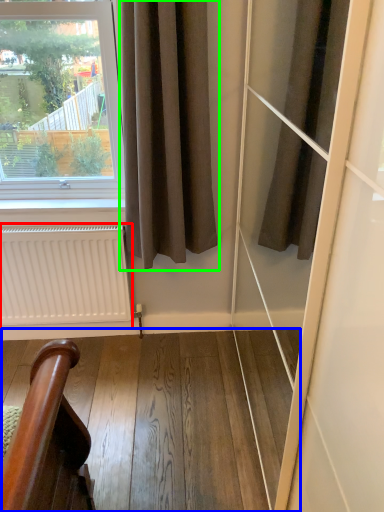
Question: Which object is the closest to the radiator (highlighted by a red box)? Choose among these: stairwell (highlighted by a blue box) or curtain (highlighted by a green box).

Choices:
 (A) stairwell
 (B) curtain

Answer: (A)